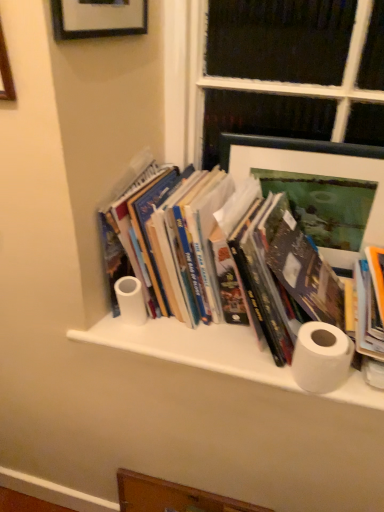
The width and height of the screenshot is (384, 512). Describe the element at coordinates (131, 300) in the screenshot. I see `white matte toilet paper at center, the 2th toilet paper viewed from the front` at that location.

Measure the distance between white matte toilet paper at right, the 1th toilet paper when ordered from right to left, and camera.

They are 31.36 inches apart.

Describe the element at coordinates (172, 496) in the screenshot. The height and width of the screenshot is (512, 384). I see `wooden drawer at lower center` at that location.

The image size is (384, 512). Describe the element at coordinates (5, 72) in the screenshot. I see `brushed metal picture frame at upper left, acting as the second picture frame starting from the right` at that location.

Find the location of a particular element. hardcover books at center is located at coordinates (324, 196).

Does point (302, 326) appear closer or farther from the camera than point (220, 336)?

Point (302, 326).

Locate an element on the screen. The height and width of the screenshot is (512, 384). toilet paper on the right side of white matte cabinet at center is located at coordinates (321, 357).

Considering the sizes of objects white matte toilet paper at right, the 1th toilet paper when ordered from right to left, and white matte cabinet at center in the image provided, who is smaller, white matte toilet paper at right, the 1th toilet paper when ordered from right to left, or white matte cabinet at center?

white matte toilet paper at right, the 1th toilet paper when ordered from right to left.

Is white matte toilet paper at right, the second toilet paper viewed from the left, further to camera compared to white matte cabinet at center?

No, it is not.

Based on their positions, is white matte toilet paper at right, the 1th toilet paper when ordered from right to left, located to the left or right of brushed metal picture frame at upper left, the 1th picture frame when ordered from top to bottom?

In the image, white matte toilet paper at right, the 1th toilet paper when ordered from right to left, appears on the right side of brushed metal picture frame at upper left, the 1th picture frame when ordered from top to bottom.

In the image, is white matte toilet paper at right, the 1th toilet paper in the front-to-back sequence, positioned in front of or behind brushed metal picture frame at upper left, which is the first picture frame from left to right?

Clearly, white matte toilet paper at right, the 1th toilet paper in the front-to-back sequence, is behind brushed metal picture frame at upper left, which is the first picture frame from left to right.

Based on the photo, is brushed metal picture frame at upper left, the 2th picture frame from the back, completely or partially inside white matte toilet paper at right, the 1th toilet paper when ordered from right to left?

No, brushed metal picture frame at upper left, the 2th picture frame from the back, is located outside of white matte toilet paper at right, the 1th toilet paper when ordered from right to left.

Is brushed metal picture frame at upper left, which is counted as the 1th picture frame, starting from the front, at the back of white matte toilet paper at right, placed as the second toilet paper when sorted from back to front?

white matte toilet paper at right, placed as the second toilet paper when sorted from back to front, is not turned away from brushed metal picture frame at upper left, which is counted as the 1th picture frame, starting from the front.

Is point (337, 246) behind point (323, 358)?

Yes.

Which is more to the left, hardcover books at center or white matte toilet paper at right, the 1th toilet paper when ordered from right to left?

Positioned to the left is hardcover books at center.

Is hardcover books at center taller or shorter than white matte toilet paper at right, the second toilet paper viewed from the left?

hardcover books at center is taller than white matte toilet paper at right, the second toilet paper viewed from the left.

How many degrees apart are the facing directions of hardcover books at center and white matte toilet paper at right, the second toilet paper viewed from the left?

There is a 0.00626-degree angle between the facing directions of hardcover books at center and white matte toilet paper at right, the second toilet paper viewed from the left.

Which of these two, white matte toilet paper at center, the 2th toilet paper viewed from the right, or white matte toilet paper at right, placed as the second toilet paper when sorted from back to front, is bigger?

white matte toilet paper at right, placed as the second toilet paper when sorted from back to front.

Is white matte toilet paper at center, the first toilet paper viewed from the left, wider than white matte toilet paper at right, the 1th toilet paper when ordered from right to left?

No.

From the image's perspective, which object appears higher, white matte toilet paper at center, placed as the first toilet paper when sorted from back to front, or white matte toilet paper at right, the 1th toilet paper when ordered from right to left?

white matte toilet paper at center, placed as the first toilet paper when sorted from back to front, is shown above in the image.

Does white matte toilet paper at center, the 2th toilet paper viewed from the front, turn towards white matte toilet paper at right, the second toilet paper viewed from the left?

No, white matte toilet paper at center, the 2th toilet paper viewed from the front, does not turn towards white matte toilet paper at right, the second toilet paper viewed from the left.

Which object is further away from the camera, wooden drawer at lower center or white matte cabinet at center?

wooden drawer at lower center is more distant.

Is wooden drawer at lower center shorter than white matte cabinet at center?

No.

Could you tell me if wooden drawer at lower center is turned towards white matte cabinet at center?

No, wooden drawer at lower center is not aimed at white matte cabinet at center.

Between white matte toilet paper at right, the 1th toilet paper in the front-to-back sequence, and white matte toilet paper at center, the 2th toilet paper viewed from the right, which one has more height?

white matte toilet paper at right, the 1th toilet paper in the front-to-back sequence.

Could you tell me if white matte toilet paper at right, the 1th toilet paper in the front-to-back sequence, is facing white matte toilet paper at center, the 2th toilet paper viewed from the front?

No, white matte toilet paper at right, the 1th toilet paper in the front-to-back sequence, is not aimed at white matte toilet paper at center, the 2th toilet paper viewed from the front.

Is white matte toilet paper at right, the 1th toilet paper when ordered from right to left, thinner than white matte toilet paper at center, the 2th toilet paper viewed from the right?

No.

Is there a large distance between white matte toilet paper at right, the 1th toilet paper when ordered from right to left, and white matte toilet paper at center, placed as the first toilet paper when sorted from back to front?

No, there isn't a large distance between white matte toilet paper at right, the 1th toilet paper when ordered from right to left, and white matte toilet paper at center, placed as the first toilet paper when sorted from back to front.

Find the location of a particular element. Image resolution: width=384 pixels, height=512 pixels. book on the right of brushed metal picture frame at upper left, which is counted as the 1th picture frame, starting from the front is located at coordinates (324, 196).

From a real-world perspective, which object stands above the other?

In real-world perspective, brushed metal picture frame at upper left, the 1th picture frame when ordered from top to bottom, is above.

Who is taller, hardcover books at center or brushed metal picture frame at upper left, which is counted as the 1th picture frame, starting from the front?

Standing taller between the two is brushed metal picture frame at upper left, which is counted as the 1th picture frame, starting from the front.

The height and width of the screenshot is (512, 384). I want to click on cabinet on the left of white matte toilet paper at right, placed as the second toilet paper when sorted from back to front, so click(x=192, y=347).

At what (x,y) coordinates should I click in order to perform the action: click on the 2nd picture frame above the white matte toilet paper at right, the second toilet paper viewed from the left (from the image's perspective). Please return your answer as a coordinate pair (x, y). Looking at the image, I should click on (5, 72).

When comparing their distances from matte green picture frame at upper right, which appears as the first picture frame when viewed from the back, does brushed metal picture frame at upper left, the 2th picture frame from the back, or white matte toilet paper at right, the 1th toilet paper in the front-to-back sequence, seem closer?

white matte toilet paper at right, the 1th toilet paper in the front-to-back sequence.

When comparing their distances from wooden drawer at lower center, does matte green picture frame at upper right, which is counted as the first picture frame, starting from the right, or white matte toilet paper at center, the 2th toilet paper viewed from the front, seem closer?

white matte toilet paper at center, the 2th toilet paper viewed from the front, is closer to wooden drawer at lower center.

From the image, which object appears to be nearer to white matte toilet paper at right, the second toilet paper viewed from the left, wooden drawer at lower center or hardcover books at center?

The object closer to white matte toilet paper at right, the second toilet paper viewed from the left, is hardcover books at center.

Looking at the image, which one is located closer to white matte toilet paper at right, the 1th toilet paper in the front-to-back sequence, white matte cabinet at center or matte green picture frame at upper right, which is counted as the 1th picture frame, starting from the bottom?

white matte cabinet at center lies closer to white matte toilet paper at right, the 1th toilet paper in the front-to-back sequence, than the other object.

Which object lies further to the anchor point white matte toilet paper at center, the 2th toilet paper viewed from the right, wooden drawer at lower center or hardcover books at center?

wooden drawer at lower center is positioned further to the anchor white matte toilet paper at center, the 2th toilet paper viewed from the right.

From the image, which object appears to be farther from brushed metal picture frame at upper left, the 1th picture frame when ordered from top to bottom, white matte toilet paper at center, placed as the first toilet paper when sorted from back to front, or white matte toilet paper at right, the 1th toilet paper in the front-to-back sequence?

white matte toilet paper at right, the 1th toilet paper in the front-to-back sequence, is further to brushed metal picture frame at upper left, the 1th picture frame when ordered from top to bottom.

Estimate the real-world distances between objects in this image. Which object is further from white matte cabinet at center, white matte toilet paper at center, the first toilet paper viewed from the left, or white matte toilet paper at right, the 1th toilet paper when ordered from right to left?

white matte toilet paper at center, the first toilet paper viewed from the left.

Which object lies nearer to the anchor point white matte cabinet at center, white matte toilet paper at center, the 2th toilet paper viewed from the right, or brushed metal picture frame at upper left, acting as the second picture frame starting from the right?

white matte toilet paper at center, the 2th toilet paper viewed from the right, is positioned closer to the anchor white matte cabinet at center.

The height and width of the screenshot is (512, 384). Identify the location of toilet paper between white matte cabinet at center and wooden drawer at lower center from top to bottom. (321, 357).

Where is `toilet paper between white matte toilet paper at center, the 2th toilet paper viewed from the right, and matte green picture frame at upper right, the 2th picture frame positioned from the front`? Image resolution: width=384 pixels, height=512 pixels. toilet paper between white matte toilet paper at center, the 2th toilet paper viewed from the right, and matte green picture frame at upper right, the 2th picture frame positioned from the front is located at coordinates (321, 357).

Identify the location of cabinet between hardcover books at center and white matte toilet paper at right, the 1th toilet paper when ordered from right to left, in the vertical direction. Image resolution: width=384 pixels, height=512 pixels. (192, 347).

Where is `cabinet between white matte toilet paper at center, the 2th toilet paper viewed from the right, and hardcover books at center from left to right`? The image size is (384, 512). cabinet between white matte toilet paper at center, the 2th toilet paper viewed from the right, and hardcover books at center from left to right is located at coordinates (192, 347).